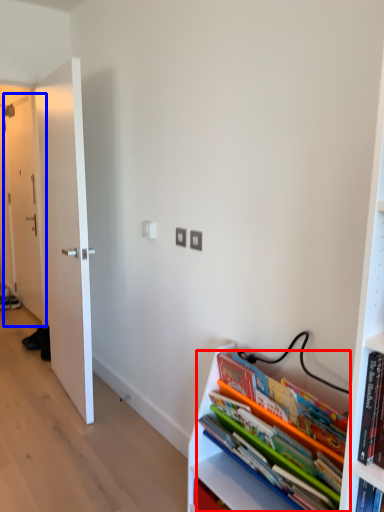
Question: Among these objects, which one is farthest to the camera, book (highlighted by a red box) or door (highlighted by a blue box)?

Choices:
 (A) book
 (B) door

Answer: (B)